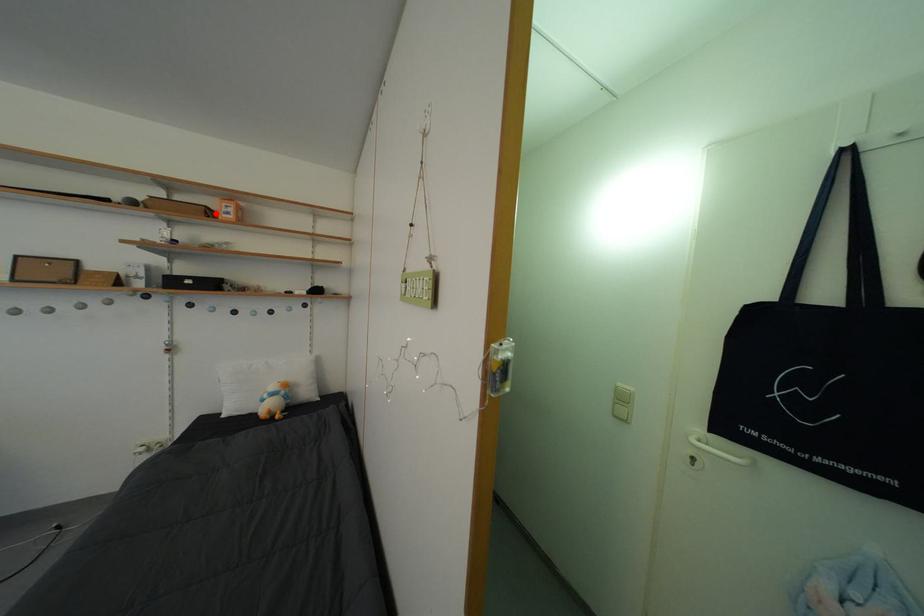
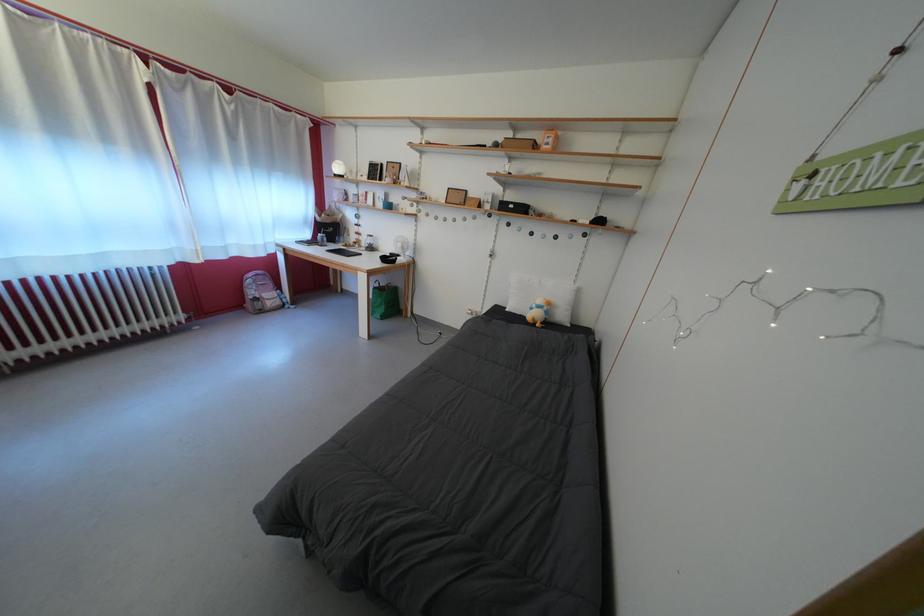
Question: I am providing you with two images of the same scene from different viewpoints. Image1 has a red point marked. In image2, the corresponding 3D location appears at what relative position? Reply with the corresponding letter.

Choices:
 (A) Closer
 (B) Farther

Answer: (A)